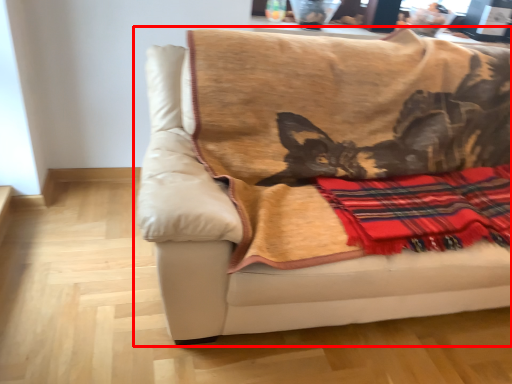
Question: From the image, what is the correct spatial relationship of studio couch (annotated by the red box) in relation to plaid?

Choices:
 (A) left
 (B) right

Answer: (A)